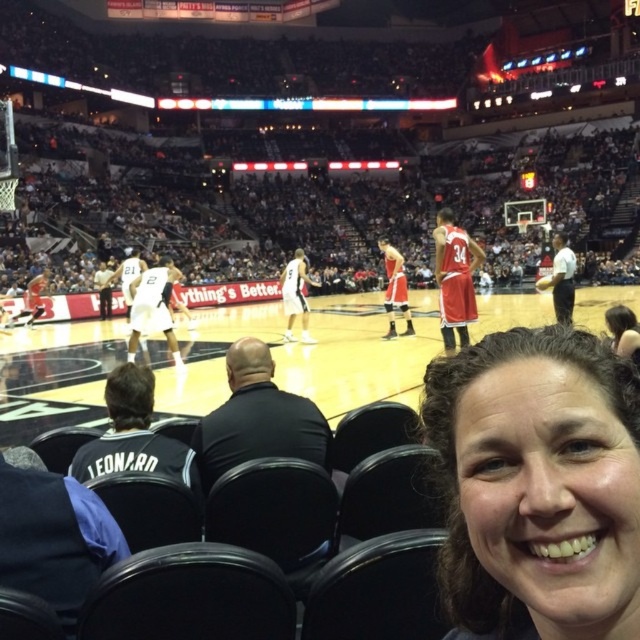
You are a photographer at the basketball game. You want to capture a photo that includes both the smooth brown hair at lower right and the wooden basketball court at center. Which object should you focus on first to ensure both are in frame?

The smooth brown hair at lower right is smaller than the wooden basketball court at center, so you should focus on the wooden basketball court at center first to ensure both fit in the frame.

You are a photographer standing at the edge of the court. You notice the smooth brown hair at lower right and the wooden basketball court at center. Which object is closer to the camera?

The smooth brown hair at lower right is closer to the camera because it is not as tall as the wooden basketball court at center, indicating it is positioned in the foreground.